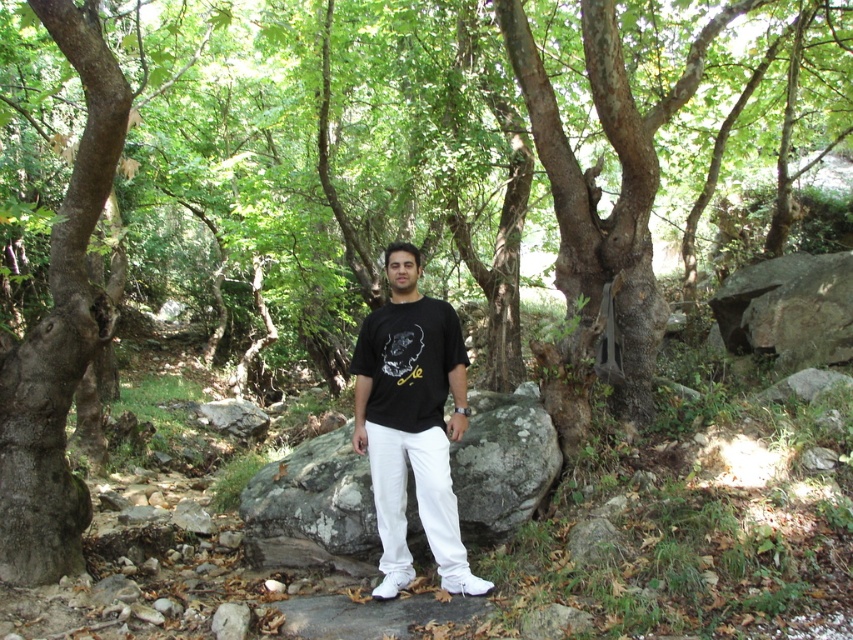
Question: Is the position of gray rough boulder at center more distant than that of black matte t-shirt at center?

Choices:
 (A) yes
 (B) no

Answer: (A)

Question: Can you confirm if gray rough boulder at center is wider than black matte t-shirt at center?

Choices:
 (A) no
 (B) yes

Answer: (B)

Question: Is gray rough boulder at center thinner than black matte t-shirt at center?

Choices:
 (A) no
 (B) yes

Answer: (A)

Question: Which point is farther from the camera taking this photo?

Choices:
 (A) (433, 545)
 (B) (244, 518)

Answer: (B)